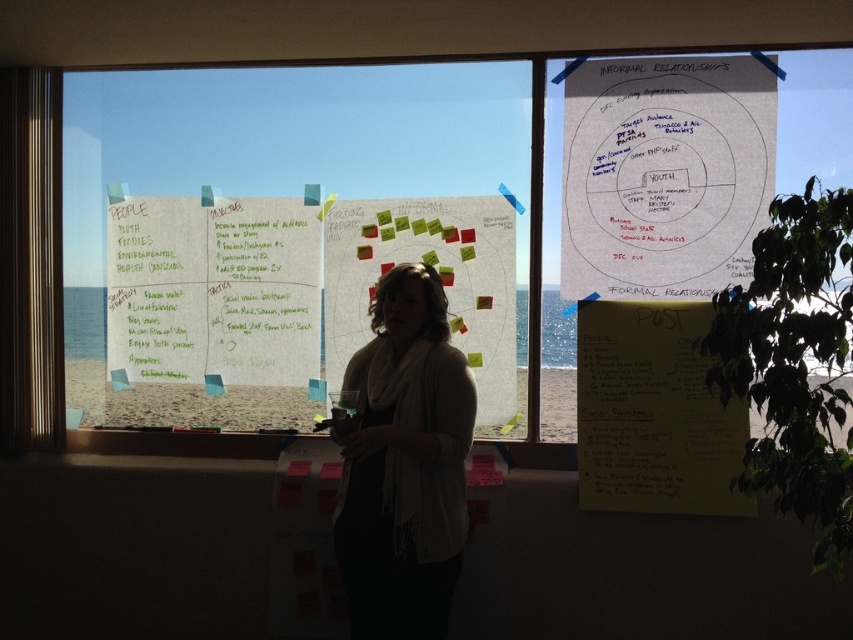
Question: Does transparent glass window at center have a greater width compared to white matte scarf at center?

Choices:
 (A) no
 (B) yes

Answer: (B)

Question: Estimate the real-world distances between objects in this image. Which object is farther from the white paper at center?

Choices:
 (A) green paperboard at center
 (B) white paper with sticky notes at center
 (C) white matte scarf at center

Answer: (C)

Question: Is the position of green paperboard at center more distant than that of white paper with sticky notes at center?

Choices:
 (A) yes
 (B) no

Answer: (A)

Question: Which point is closer to the camera?

Choices:
 (A) (248, 113)
 (B) (346, 538)

Answer: (B)

Question: Does transparent glass window at center lie behind white paper at upper right?

Choices:
 (A) no
 (B) yes

Answer: (B)

Question: Which of the following is the closest to the observer?

Choices:
 (A) white paper with sticky notes at center
 (B) transparent glass window at center

Answer: (B)